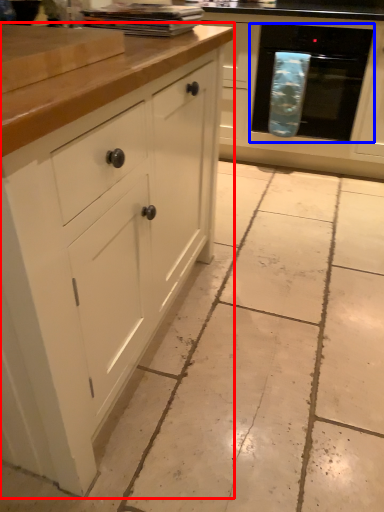
Question: Which object appears farthest to the camera in this image, cabinetry (highlighted by a red box) or oven (highlighted by a blue box)?

Choices:
 (A) cabinetry
 (B) oven

Answer: (B)